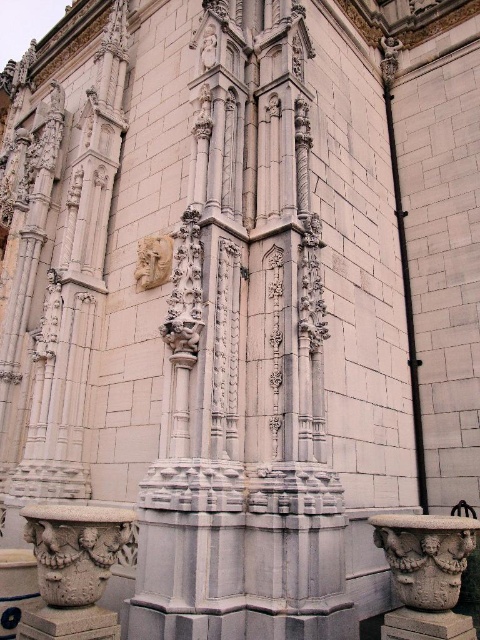
What do you see at coordinates (425, 556) in the screenshot? This screenshot has width=480, height=640. I see `carved stone vase at lower right` at bounding box center [425, 556].

Is carved stone vase at lower right in front of white stone mask at center?

Yes, it is.

Which is behind, point (427, 552) or point (144, 262)?

The point (144, 262) is more distant.

Find the location of `carved stone vase at lower right`. carved stone vase at lower right is located at coordinates (425, 556).

Which of these two, white stone sculpture at center or white stone mask at center, stands taller?

Standing taller between the two is white stone sculpture at center.

How distant is white stone sculpture at center from white stone mask at center?

white stone sculpture at center is 33.75 feet from white stone mask at center.

Does point (191, 209) lie behind point (168, 234)?

No, (191, 209) is closer to viewer.

At what (x,y) coordinates should I click in order to perform the action: click on white stone sculpture at center. Please return your answer as a coordinate pair (x, y). This screenshot has width=480, height=640. Looking at the image, I should click on (184, 292).

Is white stone column at lower left wider than white stone mask at center?

Indeed, white stone column at lower left has a greater width compared to white stone mask at center.

Between white stone column at lower left and white stone mask at center, which one is positioned higher?

white stone mask at center is above.

Which is behind, point (82, 589) or point (146, 272)?

Point (146, 272)

Find the location of a particular element. The width and height of the screenshot is (480, 640). white stone column at lower left is located at coordinates (74, 548).